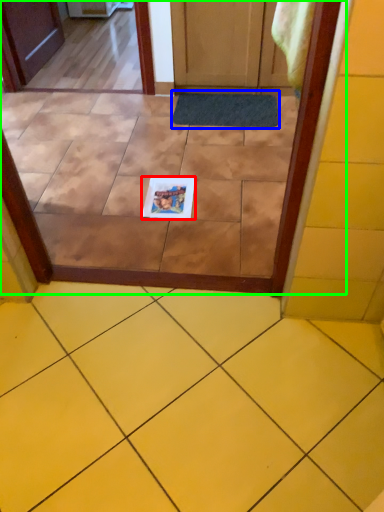
Question: Considering the real-world distances, which object is farthest from copy (highlighted by a red box)? doormat (highlighted by a blue box) or glass door (highlighted by a green box)?

Choices:
 (A) doormat
 (B) glass door

Answer: (A)